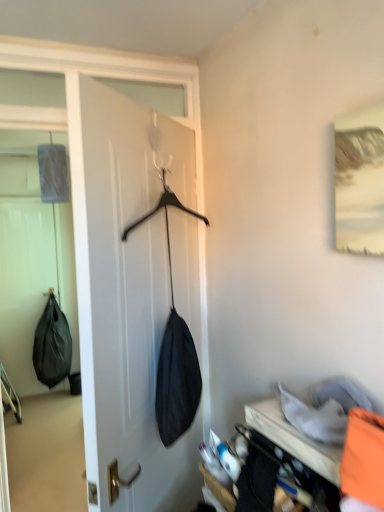
Question: Is black matte coat hanger at center oriented away from orange fabric at lower right?

Choices:
 (A) no
 (B) yes

Answer: (B)

Question: Would you say black matte coat hanger at center is outside orange fabric at lower right?

Choices:
 (A) yes
 (B) no

Answer: (A)

Question: Is black matte coat hanger at center wider than orange fabric at lower right?

Choices:
 (A) no
 (B) yes

Answer: (A)

Question: Could you tell me if black matte coat hanger at center is turned towards orange fabric at lower right?

Choices:
 (A) yes
 (B) no

Answer: (B)

Question: Can you confirm if black matte coat hanger at center is positioned to the left of orange fabric at lower right?

Choices:
 (A) yes
 (B) no

Answer: (A)

Question: Considering the relative sizes of black matte coat hanger at center and orange fabric at lower right in the image provided, is black matte coat hanger at center taller than orange fabric at lower right?

Choices:
 (A) no
 (B) yes

Answer: (B)

Question: Is orange fabric bag at lower right completely or partially inside black matte coat hanger at center?

Choices:
 (A) yes
 (B) no

Answer: (B)

Question: Is the depth of black matte coat hanger at center greater than that of orange fabric bag at lower right?

Choices:
 (A) yes
 (B) no

Answer: (A)

Question: Does black matte coat hanger at center have a smaller size compared to orange fabric bag at lower right?

Choices:
 (A) no
 (B) yes

Answer: (A)

Question: Is black matte coat hanger at center taller than orange fabric bag at lower right?

Choices:
 (A) yes
 (B) no

Answer: (A)

Question: Is black matte coat hanger at center beside orange fabric bag at lower right?

Choices:
 (A) no
 (B) yes

Answer: (A)

Question: Does black matte coat hanger at center appear on the right side of orange fabric bag at lower right?

Choices:
 (A) yes
 (B) no

Answer: (B)

Question: Does black matte shoulder bag at left have a larger size compared to orange fabric bag at lower right?

Choices:
 (A) no
 (B) yes

Answer: (B)